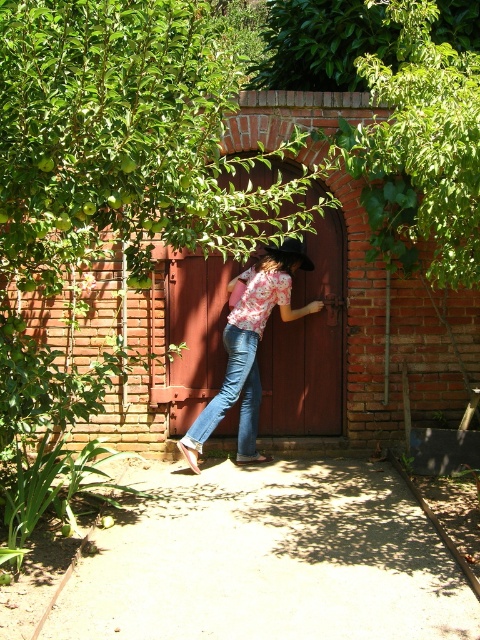
Does point (256, 273) lie behind point (308, 268)?

No, (256, 273) is in front of (308, 268).

Which of these two, floral shirt and jeans at center or brown felt cowboy hat at center, stands taller?

Standing taller between the two is floral shirt and jeans at center.

This screenshot has width=480, height=640. What are the coordinates of `floral shirt and jeans at center` in the screenshot? It's located at (250, 348).

Which is more to the left, denim jeans at center or brown felt cowboy hat at center?

From the viewer's perspective, denim jeans at center appears more on the left side.

Measure the distance from denim jeans at center to brown felt cowboy hat at center.

denim jeans at center is 4.04 feet from brown felt cowboy hat at center.

Who is more distant from viewer, (237, 371) or (310, 268)?

The point (310, 268) is more distant.

What are the coordinates of `denim jeans at center` in the screenshot? It's located at (232, 396).

Measure the distance between point (242,449) and camera.

Point (242,449) is 19.26 feet from camera.

From the picture: Is floral shirt and jeans at center closer to the viewer compared to denim jeans at center?

Yes, it is in front of denim jeans at center.

Find the location of a particular element. floral shirt and jeans at center is located at coordinates (250, 348).